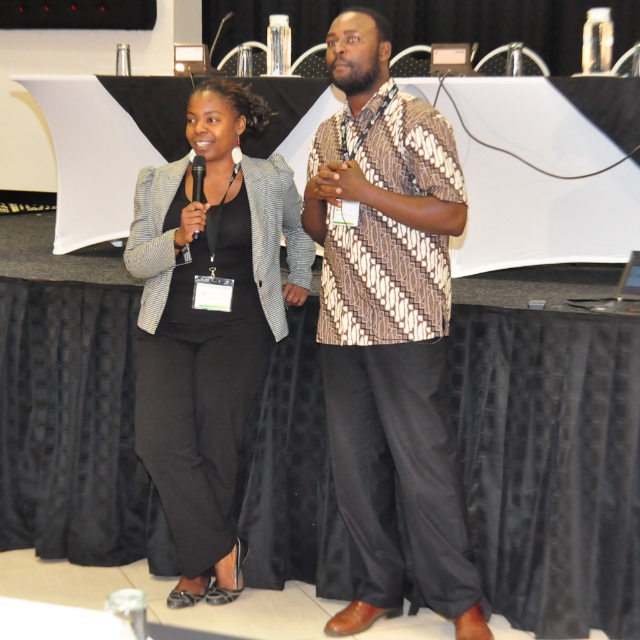
Image resolution: width=640 pixels, height=640 pixels. What do you see at coordinates (209, 323) in the screenshot?
I see `matte black blazer at center` at bounding box center [209, 323].

Between matte black blazer at center and black plastic microphone at center, which one is positioned higher?

black plastic microphone at center is above.

Which is in front, point (184, 493) or point (196, 176)?

Point (196, 176) is in front.

Locate an element on the screen. This screenshot has height=640, width=640. matte black blazer at center is located at coordinates (209, 323).

Is black fabric table at center above matte black blazer at center?

No, black fabric table at center is not above matte black blazer at center.

Does black fabric table at center lie behind matte black blazer at center?

No, black fabric table at center is in front of matte black blazer at center.

Describe the element at coordinates (548, 448) in the screenshot. I see `black fabric table at center` at that location.

At what (x,y) coordinates should I click in order to perform the action: click on black fabric table at center. Please return your answer as a coordinate pair (x, y). Image resolution: width=640 pixels, height=640 pixels. Looking at the image, I should click on (548, 448).

How far apart are patterned fabric shirt at center and matte black blazer at center?

patterned fabric shirt at center is 18.55 inches from matte black blazer at center.

Between point (410, 502) and point (241, 241), which one is positioned behind?

Positioned behind is point (241, 241).

Locate an element on the screen. Image resolution: width=640 pixels, height=640 pixels. patterned fabric shirt at center is located at coordinates (388, 332).